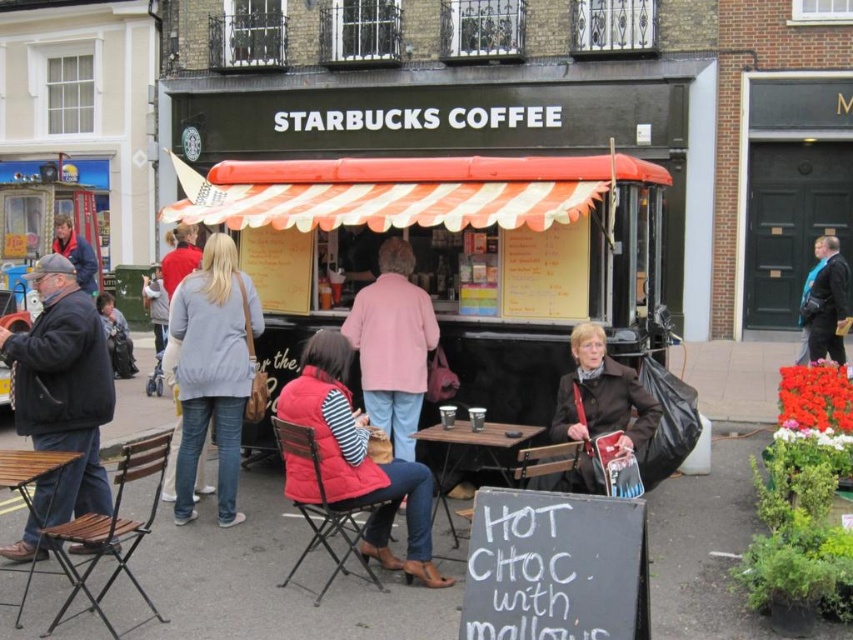
Question: Which point is closer to the camera?

Choices:
 (A) red quilted vest at center
 (B) dark blue jacket at upper right
 (C) matte black jacket at left

Answer: (A)

Question: Can you confirm if black matte food truck at center is positioned to the left of matte black jacket at left?

Choices:
 (A) yes
 (B) no

Answer: (B)

Question: Which point is farther to the camera?

Choices:
 (A) matte black jacket at lower left
 (B) red quilted vest at center
 (C) metallic silver cart at left
 (D) black matte food truck at center

Answer: (A)

Question: Which point is farther to the camera?

Choices:
 (A) wooden table at center
 (B) light gray cotton jacket at center

Answer: (B)

Question: Does dark blue jacket at left lie behind brown leather jacket at lower right?

Choices:
 (A) no
 (B) yes

Answer: (A)

Question: Is dark blue jacket at left positioned behind metallic silver cart at left?

Choices:
 (A) yes
 (B) no

Answer: (B)